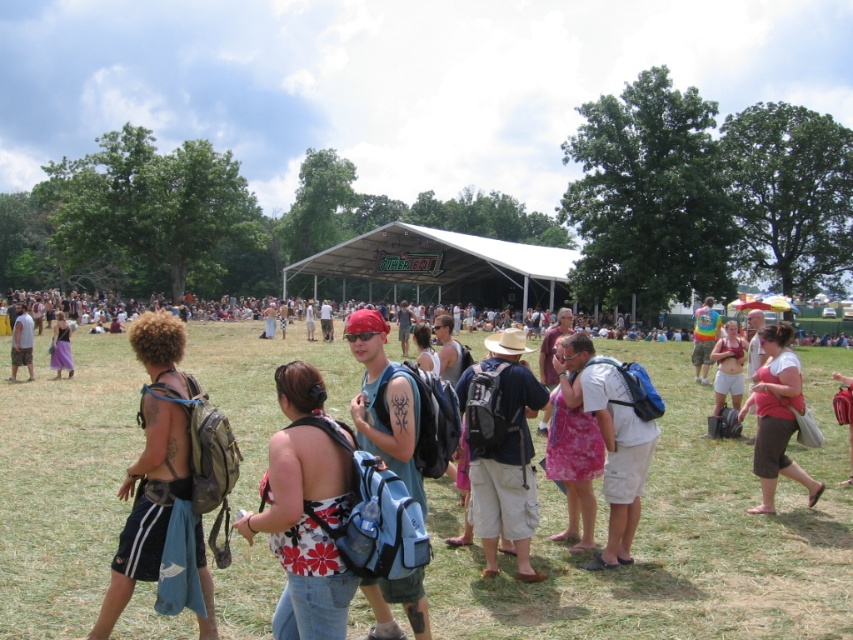
Question: Which of the following is the farthest from the observer?

Choices:
 (A) pyautogui.click(x=733, y=358)
 (B) pyautogui.click(x=610, y=561)
 (C) pyautogui.click(x=25, y=339)

Answer: (C)

Question: From the image, what is the correct spatial relationship of camouflage-patterned backpack at left in relation to skinny white tank top at center?

Choices:
 (A) right
 (B) left

Answer: (B)

Question: Which object is farther from the camera taking this photo?

Choices:
 (A) rainbow t-shirt at center
 (B) matte purple skirt at center
 (C) skinny white tank top at center

Answer: (B)

Question: Does camouflage-patterned backpack at left come behind pink fabric dress at center?

Choices:
 (A) yes
 (B) no

Answer: (B)

Question: Considering the real-world distances, which object is farthest from the rainbow t-shirt at center?

Choices:
 (A) skinny white tank top at center
 (B) pink fabric dress at lower right

Answer: (B)

Question: Can you confirm if pink fabric dress at lower right is bigger than skinny white tank top at center?

Choices:
 (A) no
 (B) yes

Answer: (A)